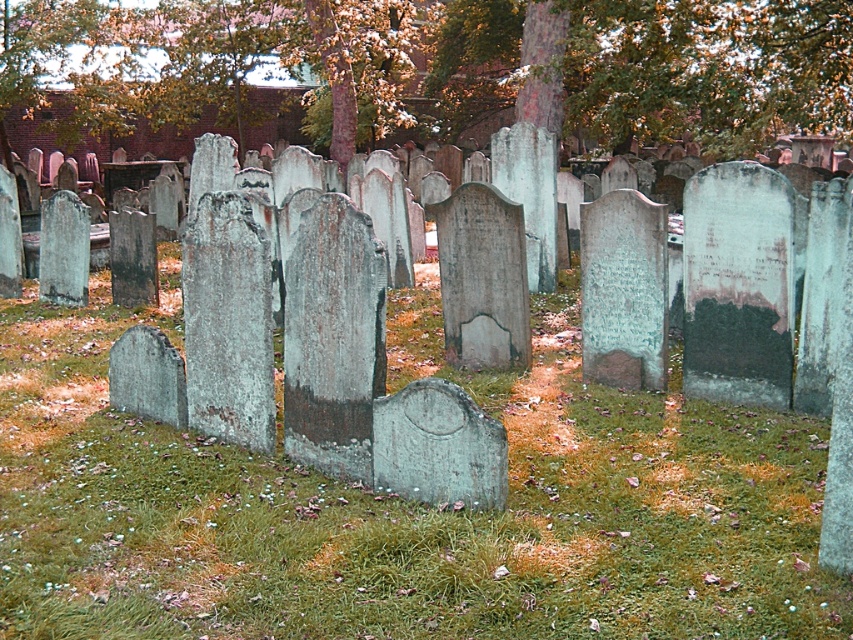
You are standing in the cemetery and want to place a small bouquet of flowers between the green mossy grass at center and the green leafy tree at center. Since you want the bouquet to be visible from where you are standing, which object should you place it closer to?

The green mossy grass at center is closer to the viewer than the green leafy tree at center, so placing the bouquet closer to the green mossy grass at center would make it more visible from your current position.

You are standing at the edge of the cemetery and want to walk towards the green leafy tree at center. As you walk, you notice the green mossy grass at center. Which object will you encounter first based on their widths?

The green mossy grass at center has a lesser width compared to the green leafy tree at center, so you will encounter the green mossy grass at center first as it is narrower.